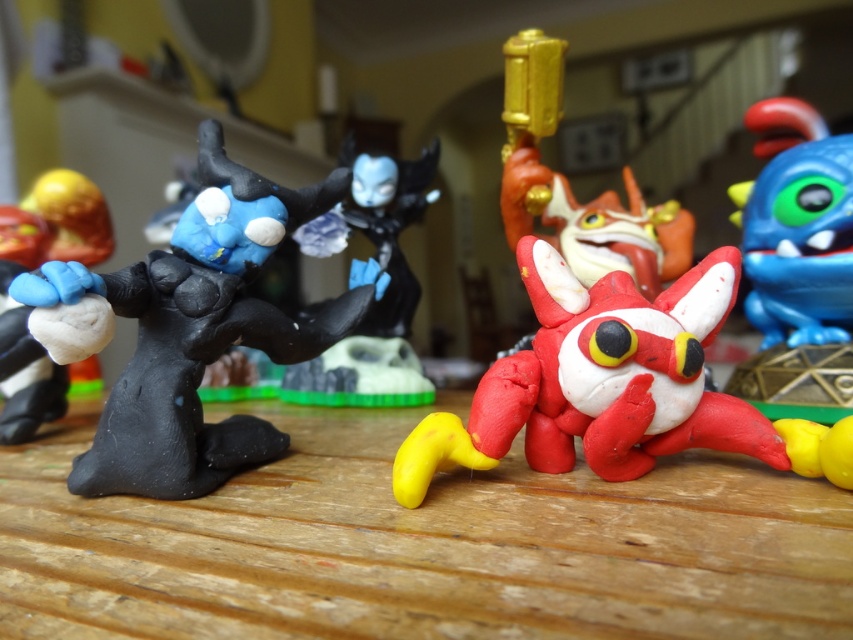
Question: Which of the following is the farthest from the observer?

Choices:
 (A) rubberized red fox at center
 (B) matte black figure at left

Answer: (B)

Question: Estimate the real-world distances between objects in this image. Which object is farther from the matte black figure at left?

Choices:
 (A) rubberized red fox at center
 (B) blue rubber dragon at right
 (C) black matte figure at left

Answer: (B)

Question: Does wooden table at center have a lesser width compared to black matte figure at left?

Choices:
 (A) yes
 (B) no

Answer: (B)

Question: Which of the following is the closest to the observer?

Choices:
 (A) blue rubber dragon at right
 (B) black matte figure at left
 (C) matte black figure at left
 (D) wooden table at center

Answer: (D)

Question: Does wooden table at center come behind black matte figure at left?

Choices:
 (A) yes
 (B) no

Answer: (B)

Question: Does black matte figure at left have a smaller size compared to blue rubber dragon at right?

Choices:
 (A) yes
 (B) no

Answer: (B)